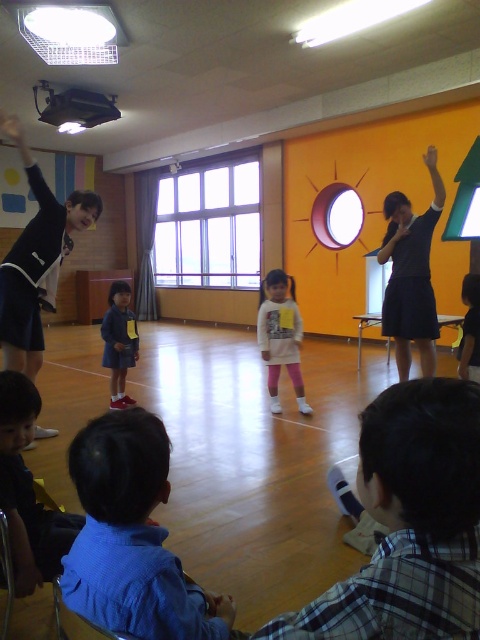
Is point (36, 536) behind point (272, 392)?

That is False.

From the picture: Can you confirm if blue fabric shirt at lower left is smaller than white matte sweater at center?

Yes, blue fabric shirt at lower left is smaller than white matte sweater at center.

Between point (17, 435) and point (291, 308), which one is positioned behind?

The point (291, 308) is behind.

Image resolution: width=480 pixels, height=640 pixels. What are the coordinates of `blue fabric shirt at lower left` in the screenshot? It's located at pos(27,492).

Is blue cotton shirt at lower left in front of matte black projector at upper left?

That is True.

Between blue cotton shirt at lower left and matte black projector at upper left, which one appears on the right side from the viewer's perspective?

blue cotton shirt at lower left is more to the right.

Is point (183, 593) behind point (1, 116)?

No, (183, 593) is in front of (1, 116).

I want to click on blue cotton shirt at lower left, so click(x=132, y=536).

Does point (14, 301) come closer to viewer compared to point (431, 160)?

That is True.

The height and width of the screenshot is (640, 480). What do you see at coordinates (37, 268) in the screenshot? I see `dark blue uniform at upper left` at bounding box center [37, 268].

Does point (37, 307) come farther from viewer compared to point (433, 152)?

No, it is in front of (433, 152).

The height and width of the screenshot is (640, 480). Identify the location of dark blue uniform at upper left. (37, 268).